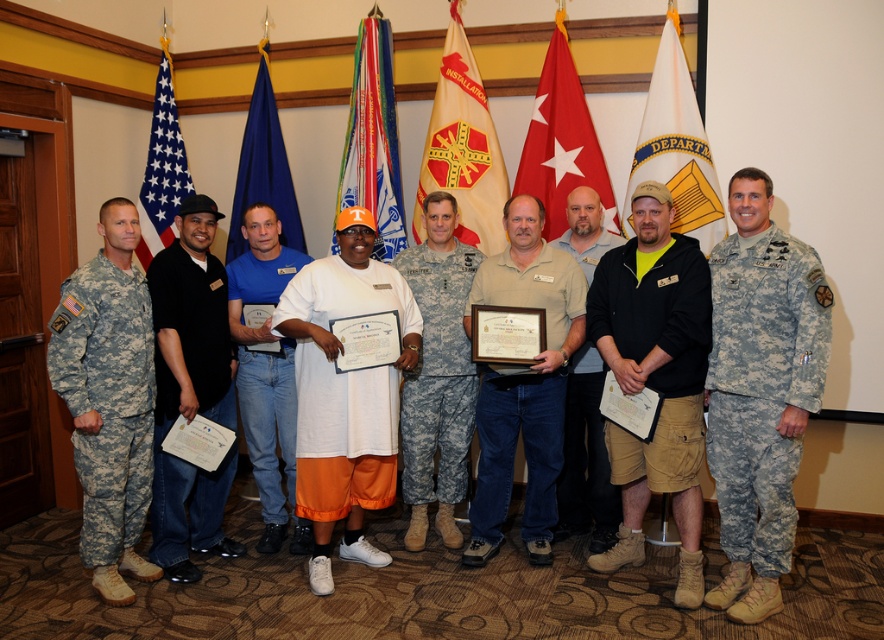
Is black matte jacket at center to the right of gold metallic flag at center from the viewer's perspective?

Correct, you'll find black matte jacket at center to the right of gold metallic flag at center.

Is black matte jacket at center bigger than gold metallic flag at center?

Indeed, black matte jacket at center has a larger size compared to gold metallic flag at center.

Where is `black matte jacket at center`? The width and height of the screenshot is (884, 640). black matte jacket at center is located at coordinates (654, 376).

This screenshot has height=640, width=884. Identify the location of beige cotton shirt at center. (x=524, y=385).

Between beige cotton shirt at center and multicolored fabric banner at center, which one is positioned higher?

multicolored fabric banner at center is higher up.

Is point (530, 532) closer to camera compared to point (357, 74)?

That is True.

Find the location of a particular element. Image resolution: width=884 pixels, height=640 pixels. beige cotton shirt at center is located at coordinates (524, 385).

Who is more forward, (482, 124) or (279, 212)?

Point (482, 124)

Does gold metallic flag at center appear on the right side of blue fabric flag at center?

Correct, you'll find gold metallic flag at center to the right of blue fabric flag at center.

Which is in front, point (440, 170) or point (248, 141)?

Point (440, 170) is in front.

This screenshot has width=884, height=640. What are the coordinates of `gold metallic flag at center` in the screenshot? It's located at (462, 148).